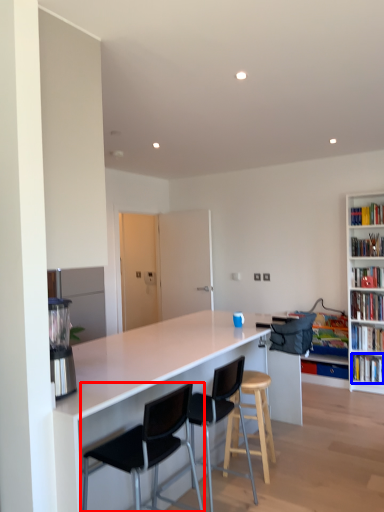
Question: Among these objects, which one is farthest to the camera, chair (highlighted by a red box) or book (highlighted by a blue box)?

Choices:
 (A) chair
 (B) book

Answer: (B)